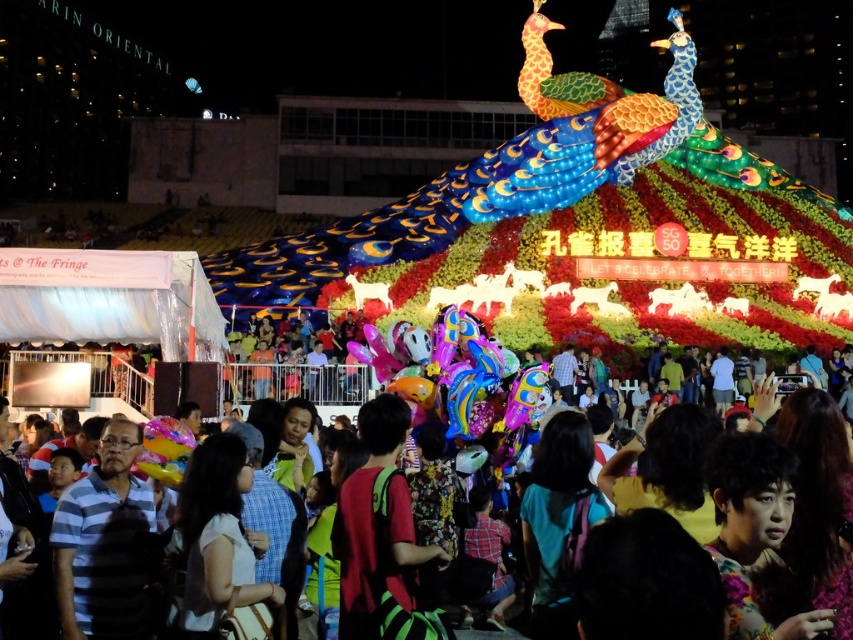
Can you confirm if striped cotton shirt at lower left is positioned to the right of multicolored fabric crowd at center?

Incorrect, striped cotton shirt at lower left is not on the right side of multicolored fabric crowd at center.

Is striped cotton shirt at lower left wider than multicolored fabric crowd at center?

In fact, striped cotton shirt at lower left might be narrower than multicolored fabric crowd at center.

Is point (57, 618) positioned before point (242, 387)?

Yes, point (57, 618) is in front of point (242, 387).

This screenshot has height=640, width=853. What are the coordinates of `striped cotton shirt at lower left` in the screenshot? It's located at [x=103, y=544].